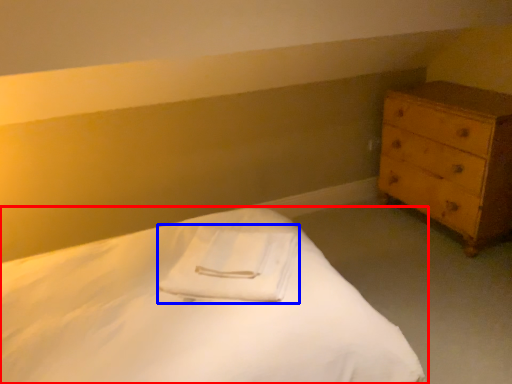
Question: Among these objects, which one is nearest to the camera, bed (highlighted by a red box) or cloth (highlighted by a blue box)?

Choices:
 (A) bed
 (B) cloth

Answer: (A)